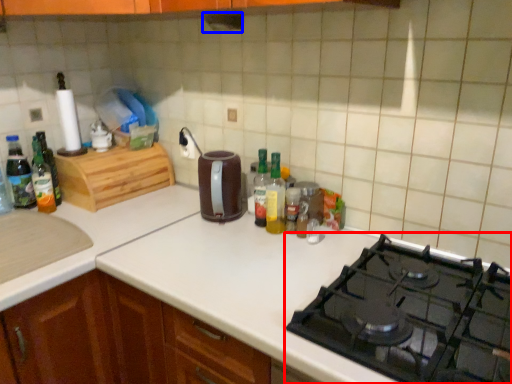
Question: Among these objects, which one is nearest to the camera, gas stove (highlighted by a red box) or exhaust hood (highlighted by a blue box)?

Choices:
 (A) gas stove
 (B) exhaust hood

Answer: (A)